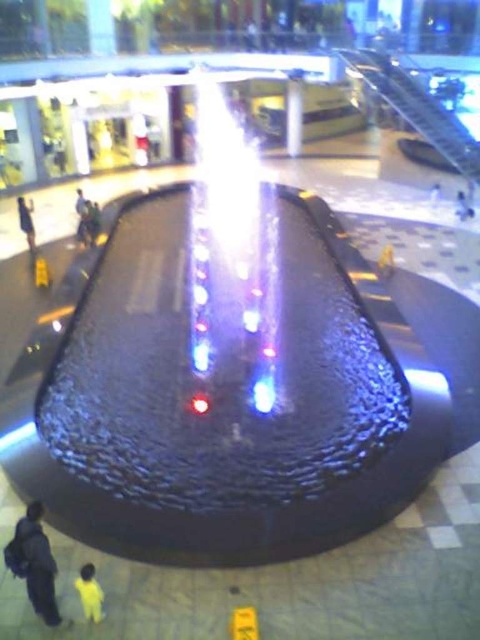
Question: Can you confirm if translucent glass water at center is thinner than dark blue jacket at lower left?

Choices:
 (A) no
 (B) yes

Answer: (A)

Question: Which of the following is the farthest from the observer?

Choices:
 (A) dark blue jacket at lower left
 (B) yellow fabric person at lower left
 (C) light blue fabric person at lower left

Answer: (C)

Question: Is dark blue jacket at lower left above light blue fabric person at lower left?

Choices:
 (A) no
 (B) yes

Answer: (A)

Question: Based on their relative distances, which object is nearer to the light blue fabric person at lower left?

Choices:
 (A) yellow fabric person at lower left
 (B) dark blue jacket at lower left
 (C) metallic silver escalator at upper right
 (D) white glossy pillar at center

Answer: (B)

Question: Which of these objects is positioned farthest from the translucent glass water at center?

Choices:
 (A) light blue fabric person at lower left
 (B) white glossy pillar at center
 (C) metallic silver escalator at upper right

Answer: (A)

Question: From the image, what is the correct spatial relationship of dark blue jacket at lower left in relation to white glossy pillar at center?

Choices:
 (A) left
 (B) right

Answer: (A)